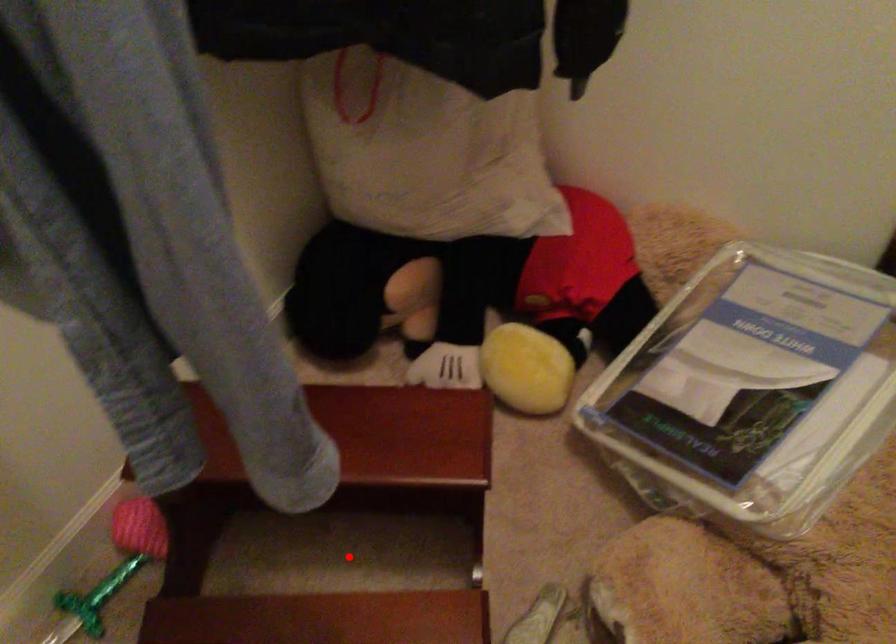
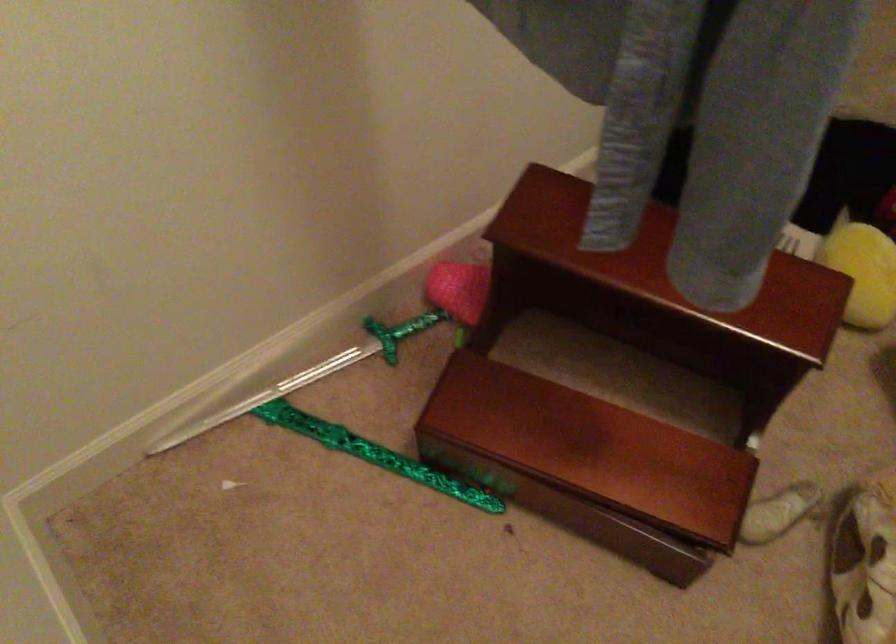
Where in the second image is the point corresponding to the highlighted location from the first image?

(621, 384)